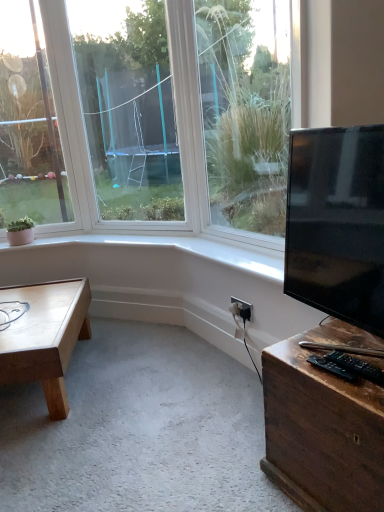
Question: Is black plastic remote control at lower right, which is counted as the first wide, starting from the left, inside or outside of light brown wooden coffee table at lower left?

Choices:
 (A) inside
 (B) outside

Answer: (B)

Question: Is black plastic remote control at lower right, which is counted as the first wide, starting from the left, wider or thinner than light brown wooden coffee table at lower left?

Choices:
 (A) thin
 (B) wide

Answer: (A)

Question: Based on their relative distances, which object is nearer to the black plastic remote control at lower right, the 2th wide viewed from the right?

Choices:
 (A) black plastic electric outlet at lower right
 (B) clear glass window at upper left
 (C) black plastic remote control at lower right, placed as the first wide when sorted from right to left
 (D) black glossy tv at right
 (E) wooden desk at lower right

Answer: (C)

Question: Which is nearer to the light brown wooden coffee table at lower left?

Choices:
 (A) clear glass window at upper left
 (B) wooden desk at lower right
 (C) black plastic electric outlet at lower right
 (D) black glossy tv at right
 (E) black plastic remote control at lower right, which is counted as the first wide, starting from the left

Answer: (C)